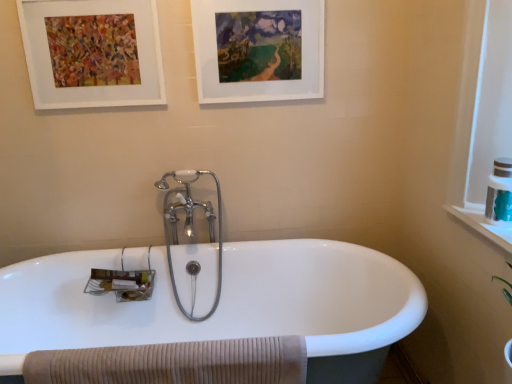
Question: From a real-world perspective, is white matte picture frame at upper center, arranged as the 1th picture frame when viewed from the right, beneath white ceramic bathtub at center?

Choices:
 (A) no
 (B) yes

Answer: (A)

Question: Is white matte picture frame at upper center, the second picture frame viewed from the left, closer to camera compared to white ceramic bathtub at center?

Choices:
 (A) no
 (B) yes

Answer: (A)

Question: Would you say white matte picture frame at upper center, the second picture frame viewed from the left, contains white ceramic bathtub at center?

Choices:
 (A) yes
 (B) no

Answer: (B)

Question: From a real-world perspective, does white matte picture frame at upper center, the second picture frame viewed from the left, stand above white ceramic bathtub at center?

Choices:
 (A) no
 (B) yes

Answer: (B)

Question: Is white matte picture frame at upper center, the second picture frame viewed from the left, thinner than white ceramic bathtub at center?

Choices:
 (A) yes
 (B) no

Answer: (A)

Question: From the image's perspective, relative to teal plastic toiletry at right, is white matte picture frame at upper left, acting as the 2th picture frame starting from the right, above or below?

Choices:
 (A) above
 (B) below

Answer: (A)

Question: From a real-world perspective, relative to teal plastic toiletry at right, is white matte picture frame at upper left, acting as the 2th picture frame starting from the right, vertically above or below?

Choices:
 (A) above
 (B) below

Answer: (A)

Question: Would you say white matte picture frame at upper left, placed as the 1th picture frame when sorted from left to right, is to the left or to the right of teal plastic toiletry at right in the picture?

Choices:
 (A) right
 (B) left

Answer: (B)

Question: From their relative heights in the image, would you say white matte picture frame at upper left, placed as the 1th picture frame when sorted from left to right, is taller or shorter than teal plastic toiletry at right?

Choices:
 (A) short
 (B) tall

Answer: (B)

Question: From a real-world perspective, is white matte picture frame at upper left, acting as the 2th picture frame starting from the right, positioned above or below polished chrome faucet at center?

Choices:
 (A) below
 (B) above

Answer: (B)

Question: Looking at the image, does white matte picture frame at upper left, acting as the 2th picture frame starting from the right, seem bigger or smaller compared to polished chrome faucet at center?

Choices:
 (A) big
 (B) small

Answer: (B)

Question: From the image's perspective, relative to polished chrome faucet at center, is white matte picture frame at upper left, placed as the 1th picture frame when sorted from left to right, above or below?

Choices:
 (A) below
 (B) above

Answer: (B)

Question: Would you say white matte picture frame at upper left, acting as the 2th picture frame starting from the right, is to the left or to the right of polished chrome faucet at center in the picture?

Choices:
 (A) right
 (B) left

Answer: (B)

Question: Relative to teal plastic toiletry at right, is white ceramic bathtub at center in front or behind?

Choices:
 (A) behind
 (B) front

Answer: (B)

Question: Considering the positions of white ceramic bathtub at center and teal plastic toiletry at right in the image, is white ceramic bathtub at center wider or thinner than teal plastic toiletry at right?

Choices:
 (A) thin
 (B) wide

Answer: (B)